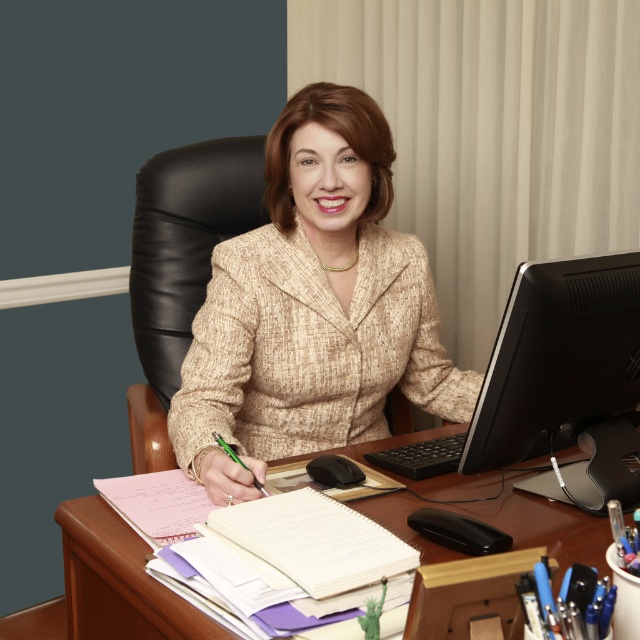
Question: Can you confirm if wooden at center is bigger than white paper notebook at center?

Choices:
 (A) no
 (B) yes

Answer: (B)

Question: Does black matte computer monitor at right have a larger size compared to wooden at center?

Choices:
 (A) yes
 (B) no

Answer: (B)

Question: Which point is closer to the camera?

Choices:
 (A) black matte computer monitor at right
 (B) wooden at center

Answer: (B)

Question: Which of the following is the farthest from the observer?

Choices:
 (A) (356, 257)
 (B) (422, 493)
 (C) (228, 508)

Answer: (A)

Question: Which point appears closest to the camera in this image?

Choices:
 (A) (620, 428)
 (B) (326, 500)
 (C) (323, 148)
 (D) (497, 506)

Answer: (B)

Question: Does beige textured suit at center have a greater width compared to wooden at center?

Choices:
 (A) no
 (B) yes

Answer: (B)